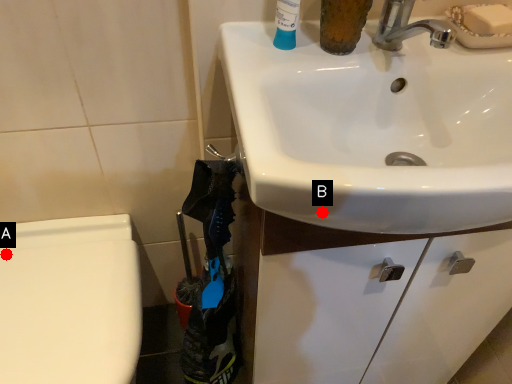
Question: Two points are circled on the image, labeled by A and B beside each circle. Which point is further to the camera?

Choices:
 (A) A is further
 (B) B is further

Answer: (A)